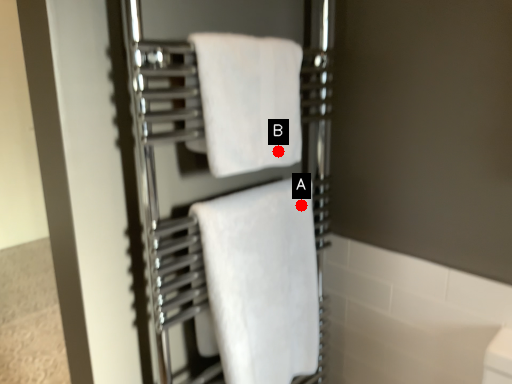
Question: Two points are circled on the image, labeled by A and B beside each circle. Which point is further to the camera?

Choices:
 (A) A is further
 (B) B is further

Answer: (A)